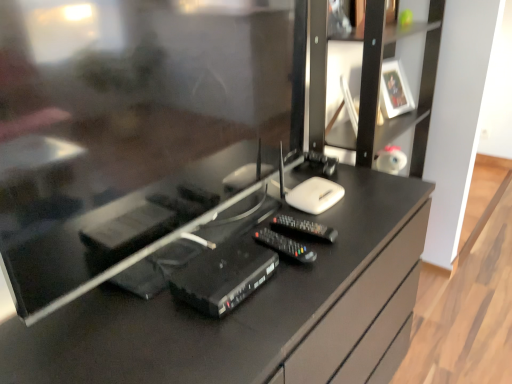
Locate an element on the screen. unoccupied region to the right of black plastic remote control at center, acting as the 1th equipment starting from the right is located at coordinates pyautogui.click(x=347, y=241).